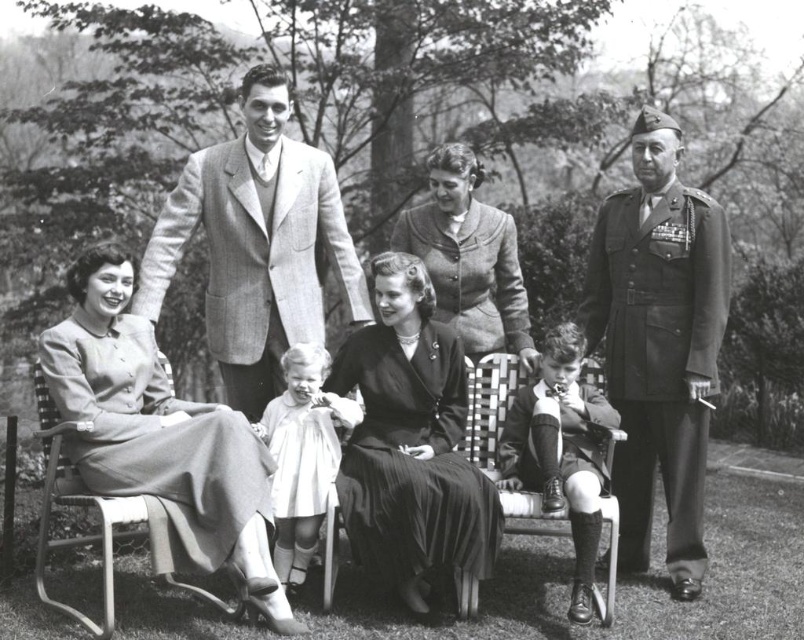
Question: Can you confirm if uniformed military officer at right is positioned below matte black dress at center?

Choices:
 (A) no
 (B) yes

Answer: (A)

Question: Is matte gray dress at lower left thinner than matte black dress at center?

Choices:
 (A) no
 (B) yes

Answer: (A)

Question: Considering the real-world distances, which object is closest to the smooth woolen suit at lower center?

Choices:
 (A) smooth wool suit at center
 (B) matte gray dress at center
 (C) uniformed military officer at right
 (D) white satin dress at center

Answer: (C)

Question: Among these points, which one is nearest to the camera?

Choices:
 (A) (439, 248)
 (B) (282, 260)
 (C) (531, 460)

Answer: (C)

Question: Which point is closer to the camera?

Choices:
 (A) matte gray dress at center
 (B) uniformed military officer at right
 (C) matte black dress at center
 (D) smooth wool suit at center

Answer: (C)

Question: Can you confirm if uniformed military officer at right is smaller than matte gray dress at lower left?

Choices:
 (A) yes
 (B) no

Answer: (A)